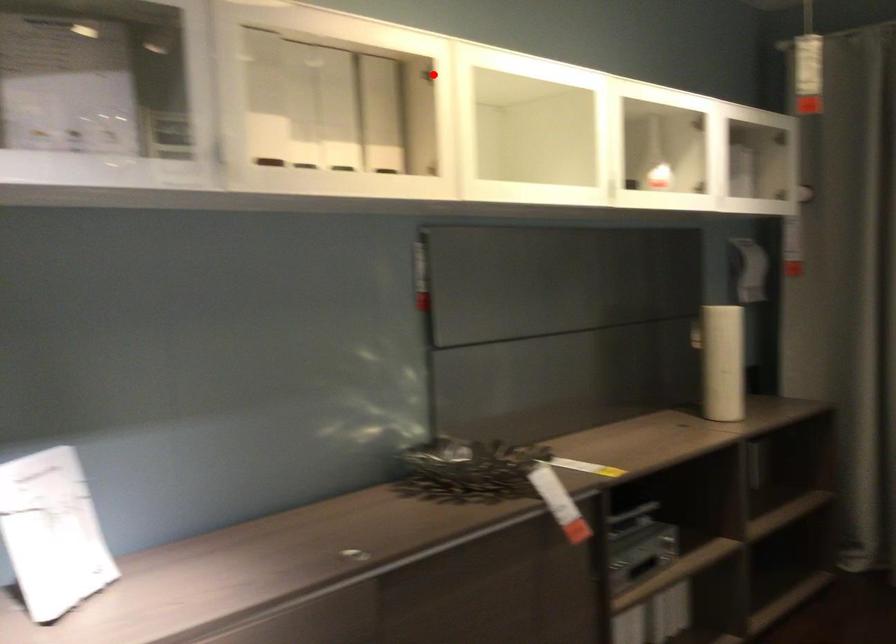
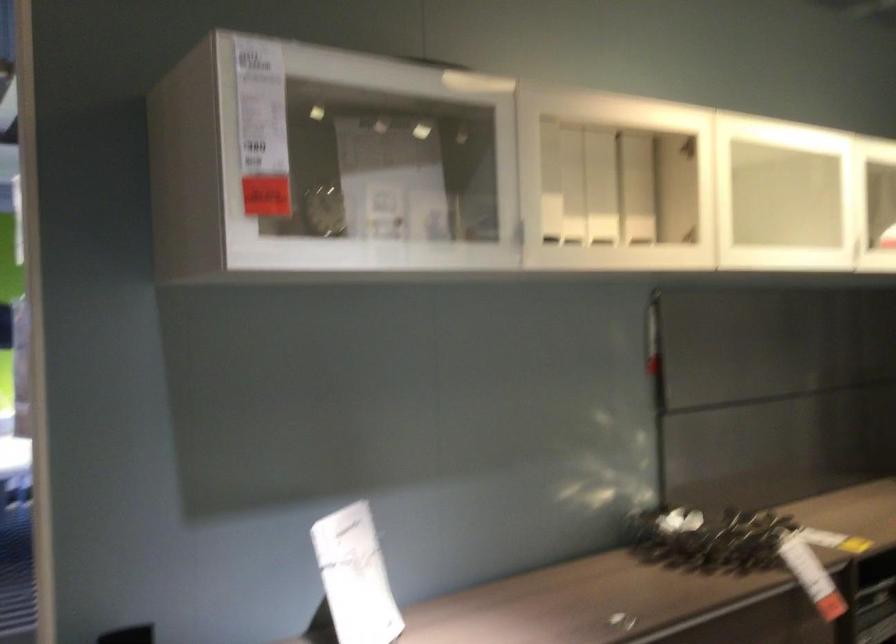
In the second image, find the point that corresponds to the highlighted location in the first image.

(688, 147)